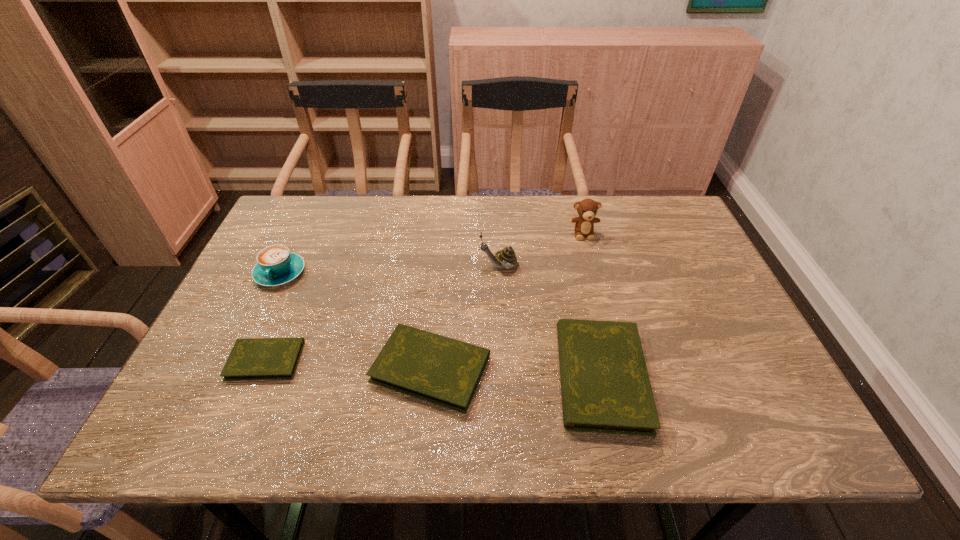
Find the location of a particular element. The height and width of the screenshot is (540, 960). vacant space that satisfies the following two spatial constraints: 1. with the handle on the right side of the cappuccino; 2. on the right side of the shortest object is located at coordinates (239, 360).

You are a GUI agent. You are given a task and a screenshot of the screen. Output one action in this format:
    pyautogui.click(x=<x>, y=<y>)
    Task: Click on the vacant space that satisfies the following two spatial constraints: 1. on the front side of the leftmost diary; 2. on the left side of the second tallest diary
    The image size is (960, 540).
    Given the screenshot: What is the action you would take?
    pyautogui.click(x=262, y=368)

Identify the location of free location that satisfies the following two spatial constraints: 1. with the handle on the right side of the rightmost diary; 2. on the left side of the cappuccino. (231, 376).

The height and width of the screenshot is (540, 960). Identify the location of free spot that satisfies the following two spatial constraints: 1. on the face of the snail; 2. on the back side of the rightmost diary. (504, 376).